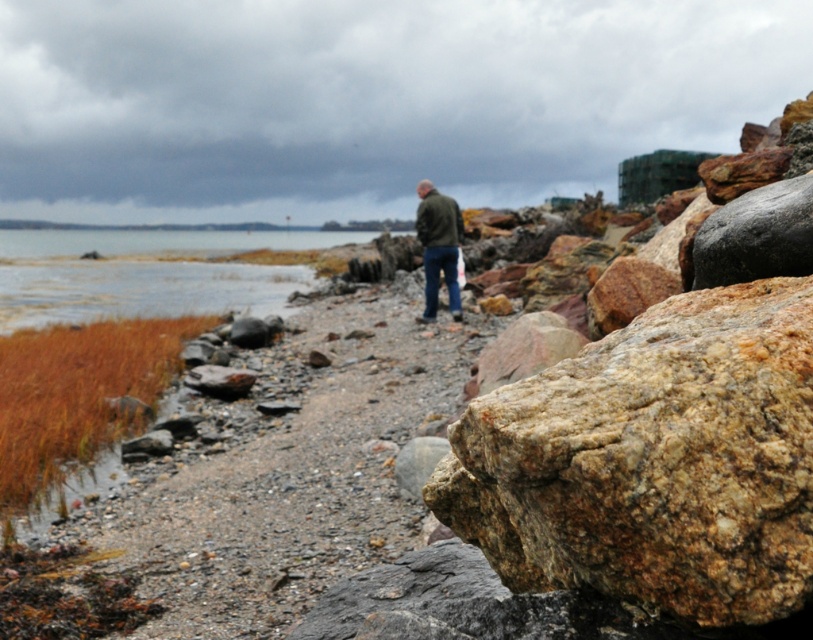
Is point (90, 289) positioned in front of point (425, 188)?

No, (90, 289) is behind (425, 188).

Find the location of a particular element. Image resolution: width=813 pixels, height=640 pixels. clear water at lower left is located at coordinates (146, 273).

Measure the distance between point (x=198, y=467) and camera.

Point (x=198, y=467) is 8.73 meters away from camera.

Does point (455, 396) come behind point (264, 298)?

No, it is not.

Describe the element at coordinates (285, 472) in the screenshot. The height and width of the screenshot is (640, 813). I see `dull gray gravel at center` at that location.

Find the location of a particular element. This screenshot has height=640, width=813. dull gray gravel at center is located at coordinates (285, 472).

Is dull gray gravel at center closer to the viewer compared to green matte jacket at center?

Yes, dull gray gravel at center is in front of green matte jacket at center.

Can you confirm if dull gray gravel at center is positioned to the left of green matte jacket at center?

Indeed, dull gray gravel at center is positioned on the left side of green matte jacket at center.

The image size is (813, 640). Identify the location of dull gray gravel at center. (285, 472).